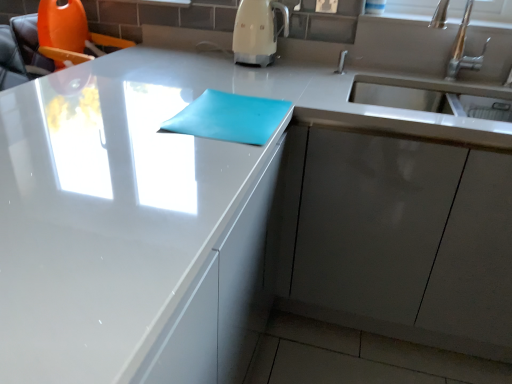
Where is `space that is in front of white glossy coffee machine at upper center`? This screenshot has width=512, height=384. space that is in front of white glossy coffee machine at upper center is located at coordinates (232, 68).